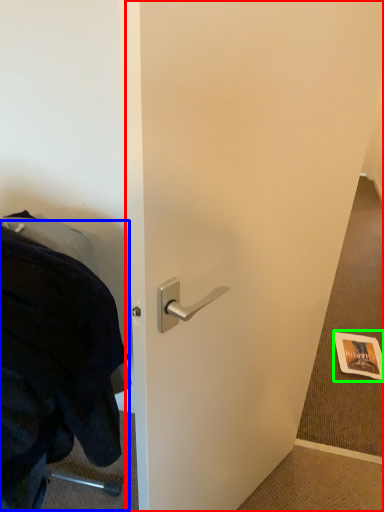
Question: Which object is the farthest from door (highlighted by a red box)? Choose among these: blanket (highlighted by a blue box) or postcard (highlighted by a green box).

Choices:
 (A) blanket
 (B) postcard

Answer: (B)